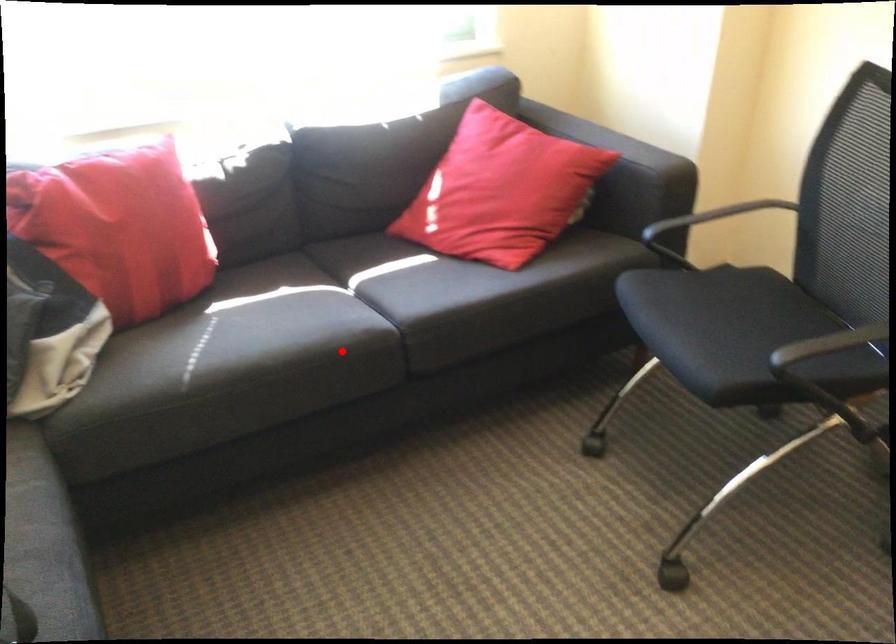
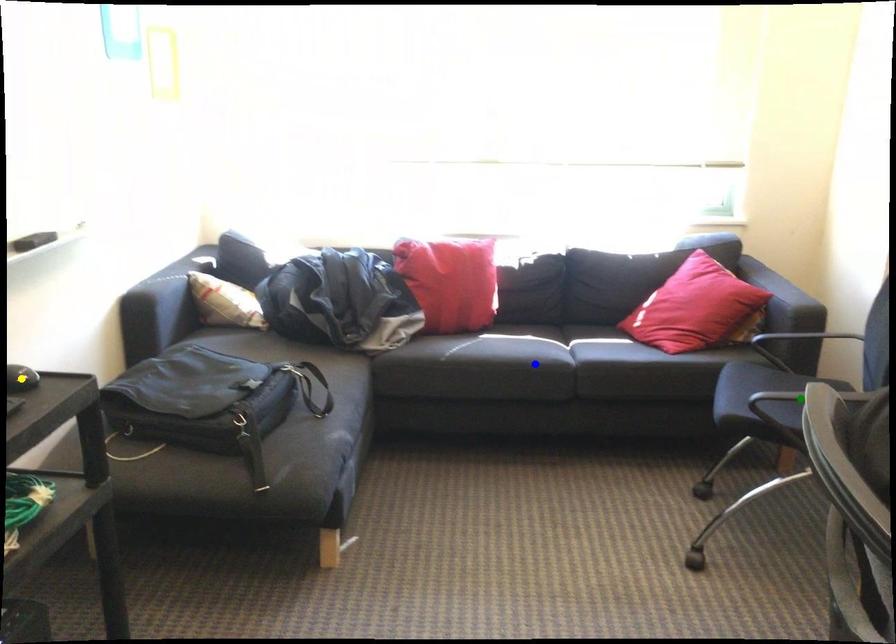
Question: I am providing you with two images of the same scene from different viewpoints. A red point is marked on the first image. You are given multiple points on the second image. Which mark in image 2 goes with the point in image 1?

Choices:
 (A) blue point
 (B) green point
 (C) yellow point

Answer: (A)